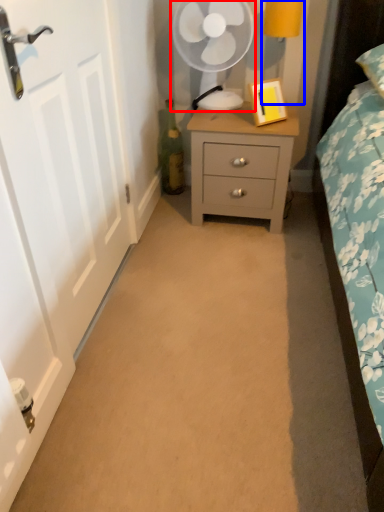
Question: Which object is further to the camera taking this photo, mechanical fan (highlighted by a red box) or bedside lamp (highlighted by a blue box)?

Choices:
 (A) mechanical fan
 (B) bedside lamp

Answer: (A)